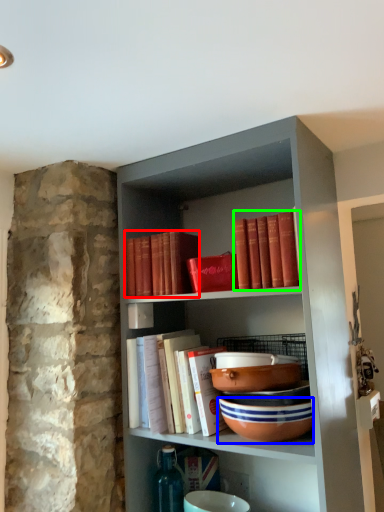
Question: Which is nearer to the book (highlighted by a red box)? bowl (highlighted by a blue box) or book (highlighted by a green box).

Choices:
 (A) bowl
 (B) book

Answer: (B)